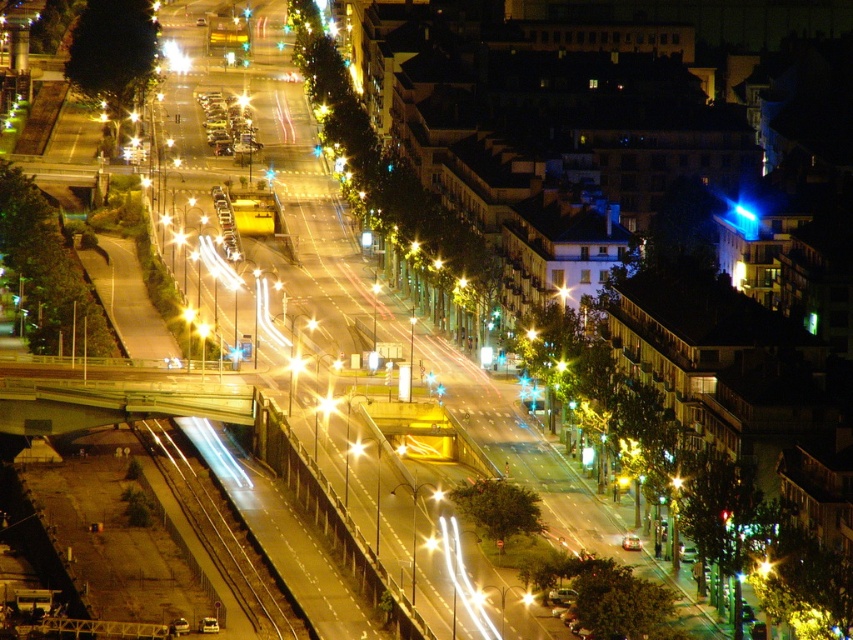
Question: Does brown metallic train track at lower left have a lesser width compared to metallic gold streetlight at center?

Choices:
 (A) yes
 (B) no

Answer: (B)

Question: Is brown metallic train track at lower left positioned behind metallic gold streetlight at center?

Choices:
 (A) yes
 (B) no

Answer: (B)

Question: Which is nearer to the metallic gray bridge at center-left?

Choices:
 (A) metallic gold streetlight at center
 (B) brown metallic train track at lower left

Answer: (B)

Question: Which point is farther from the camera taking this photo?

Choices:
 (A) pyautogui.click(x=426, y=548)
 (B) pyautogui.click(x=263, y=576)

Answer: (B)

Question: Does metallic gray bridge at center-left have a smaller size compared to brown metallic train track at lower left?

Choices:
 (A) no
 (B) yes

Answer: (B)

Question: Which object is positioned closest to the brown metallic train track at lower left?

Choices:
 (A) metallic gray bridge at center-left
 (B) metallic gold streetlight at center

Answer: (A)